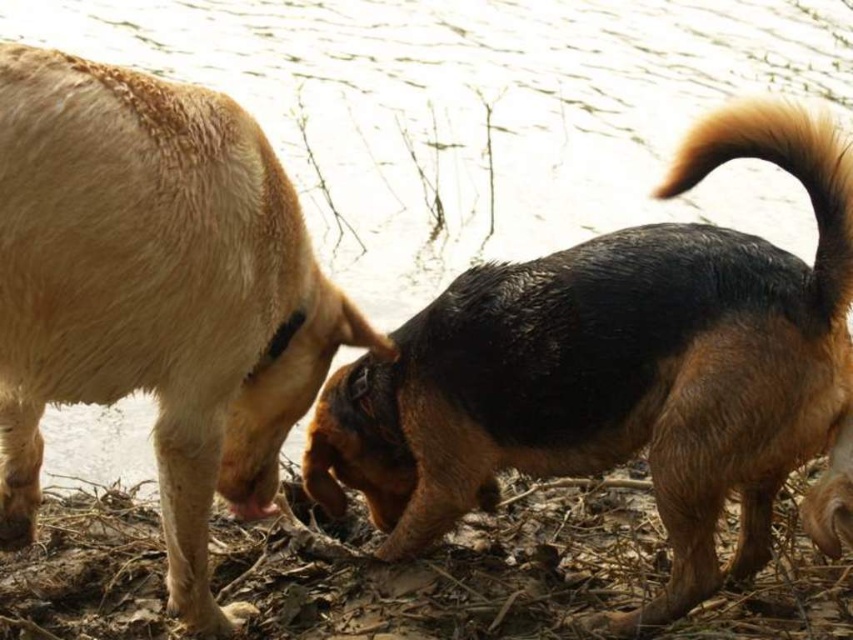
Question: Is brown fur dog at right in front of brown fuzzy tail at upper right?

Choices:
 (A) no
 (B) yes

Answer: (A)

Question: Does brown fur dog at right appear over brown fuzzy tail at upper right?

Choices:
 (A) no
 (B) yes

Answer: (A)

Question: Which point is closer to the camera?

Choices:
 (A) (735, 157)
 (B) (372, 376)

Answer: (A)

Question: Does brown fur dog at right appear on the right side of brown fuzzy tail at upper right?

Choices:
 (A) no
 (B) yes

Answer: (A)